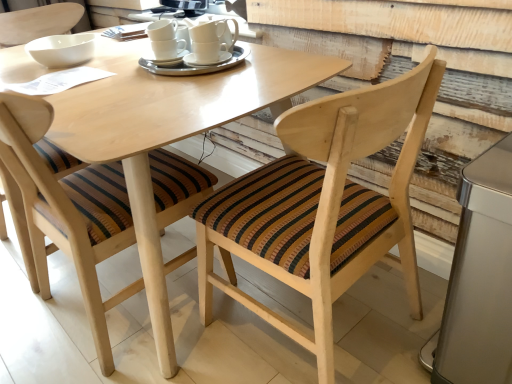
Find the location of a particular element. free area below wooden chair with striped cushion at center, which is the first chair from right to left (from a real-world perspective) is located at coordinates (333, 336).